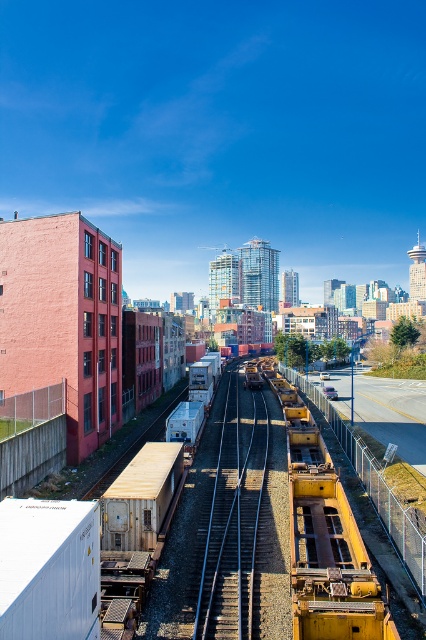
Question: Which object is farther from the camera taking this photo?

Choices:
 (A) metallic silver train track at center
 (B) rusty metal train car at center

Answer: (A)

Question: Which point appears farthest from the camera in this image?

Choices:
 (A) (339, 548)
 (B) (221, 541)

Answer: (B)

Question: Is rusty metal train car at center thinner than metallic silver train track at center?

Choices:
 (A) yes
 (B) no

Answer: (B)

Question: Is rusty metal train car at center bigger than metallic silver train track at center?

Choices:
 (A) no
 (B) yes

Answer: (B)

Question: Observing the image, what is the correct spatial positioning of rusty metal train car at center in reference to metallic silver train track at center?

Choices:
 (A) above
 (B) below

Answer: (A)

Question: Which point is farther to the camera?

Choices:
 (A) metallic silver train track at center
 (B) rusty metal train car at center

Answer: (A)